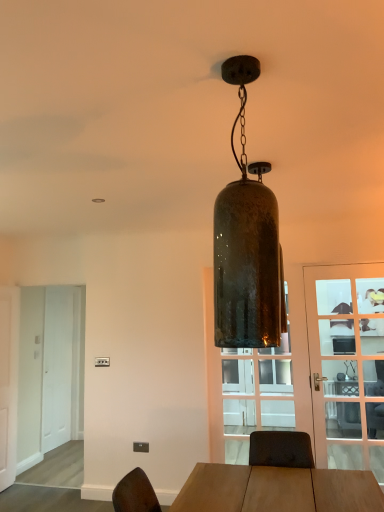
Question: In terms of width, does green glass pendant light at center look wider or thinner when compared to transparent glass door at center?

Choices:
 (A) wide
 (B) thin

Answer: (A)

Question: Considering the relative positions of green glass pendant light at center and transparent glass door at center in the image provided, is green glass pendant light at center to the left or to the right of transparent glass door at center?

Choices:
 (A) left
 (B) right

Answer: (A)

Question: Based on their relative distances, which object is farther from the white matte door at left, the 1th door from the left?

Choices:
 (A) white matte door at left, positioned as the second screen door in back-to-front order
 (B) transparent glass door at center
 (C) white wooden screen door at left, the first screen door positioned from the back
 (D) green glass pendant light at center
 (E) clear glass door at center right, which is the second door in left-to-right order

Answer: (D)

Question: Which object is positioned farthest from the clear glass door at center right, which appears as the first door when viewed from the front?

Choices:
 (A) white matte door at left, which appears as the first door when viewed from the back
 (B) transparent glass door at center
 (C) white wooden screen door at left, which is the second screen door in front-to-back order
 (D) green glass pendant light at center
 (E) white matte door at left, marked as the first screen door in a front-to-back arrangement

Answer: (C)